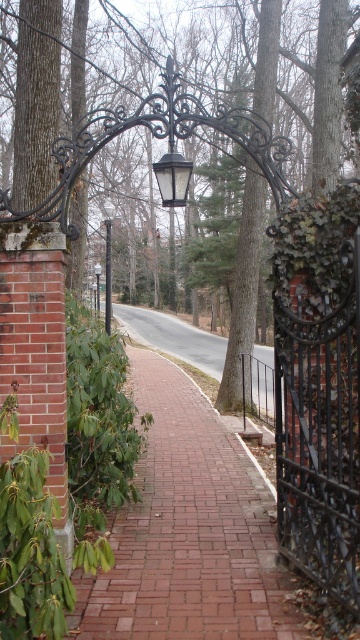
Question: Which object is closer to the camera taking this photo?

Choices:
 (A) black metal lamp post at center
 (B) black wrought iron lamp post at center
 (C) green glossy ivy at left

Answer: (C)

Question: Which point appears farthest from the camera in this image?

Choices:
 (A) (96, 288)
 (B) (313, 336)

Answer: (A)

Question: Considering the relative positions of brick at center and green leafy tree at center in the image provided, where is brick at center located with respect to green leafy tree at center?

Choices:
 (A) above
 (B) below

Answer: (B)

Question: Estimate the real-world distances between objects in this image. Which object is farther from the green glossy ivy at left?

Choices:
 (A) black metal lamp post at center
 (B) satin silver pole at center

Answer: (B)

Question: Is black wrought iron gate at center right further to camera compared to satin silver pole at center?

Choices:
 (A) no
 (B) yes

Answer: (A)

Question: Can you confirm if green leafy tree at center is positioned below black metal lamp post at center?

Choices:
 (A) yes
 (B) no

Answer: (B)